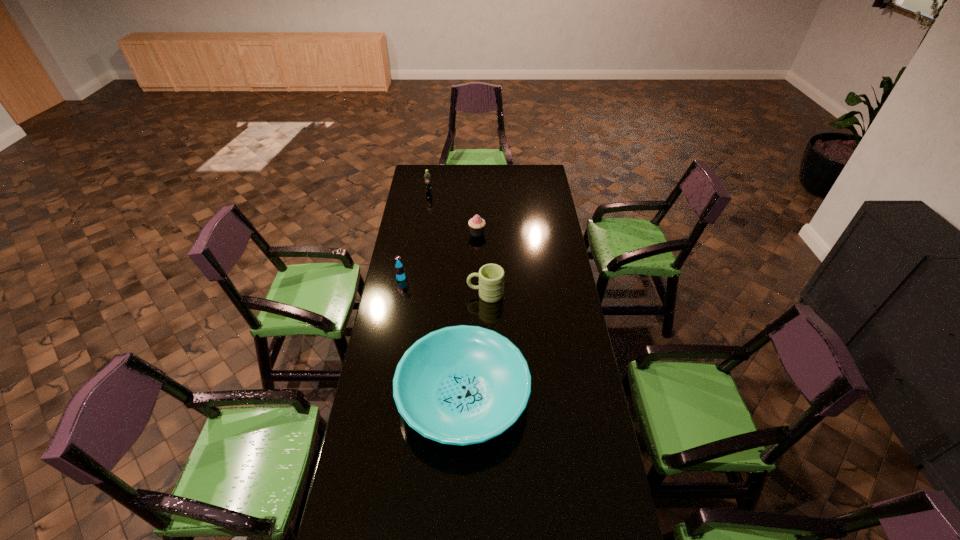
Identify the location of the farthest object. (427, 177).

Image resolution: width=960 pixels, height=540 pixels. Find the location of `the right soda`. the right soda is located at coordinates (427, 177).

The height and width of the screenshot is (540, 960). I want to click on the second nearest object, so click(491, 276).

Find the location of a particular element. Image resolution: width=960 pixels, height=540 pixels. the leftmost object is located at coordinates (399, 270).

The width and height of the screenshot is (960, 540). What are the coordinates of `the left soda` in the screenshot? It's located at (399, 270).

Where is `cupcake`? cupcake is located at coordinates (476, 224).

Where is `the nearest object`? the nearest object is located at coordinates (460, 385).

The image size is (960, 540). What are the coordinates of `vacant space located 0.260m on the front label of the right soda` in the screenshot? It's located at [424, 220].

This screenshot has width=960, height=540. What are the coordinates of `vacant area situated 0.320m on the side of the fourth farthest object with the handle` in the screenshot? It's located at (397, 294).

Where is `free space located on the side of the fourth farthest object with the handle`? The image size is (960, 540). free space located on the side of the fourth farthest object with the handle is located at coordinates (402, 294).